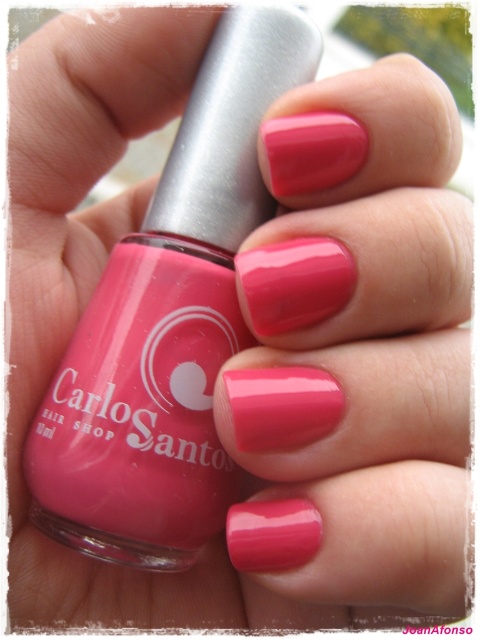
Is point (336, 449) positioned before point (155, 449)?

Yes, point (336, 449) is closer to viewer.

Does glossy pink nails at center have a lesser height compared to matte pink nail polish at center?

Incorrect, glossy pink nails at center's height does not fall short of matte pink nail polish at center's.

Which is behind, point (433, 307) or point (288, 29)?

Positioned behind is point (288, 29).

Locate an element on the screen. glossy pink nails at center is located at coordinates (354, 355).